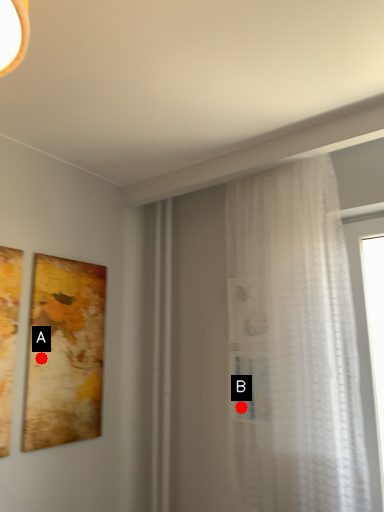
Question: Two points are circled on the image, labeled by A and B beside each circle. Among these points, which one is nearest to the camera?

Choices:
 (A) A is closer
 (B) B is closer

Answer: (A)